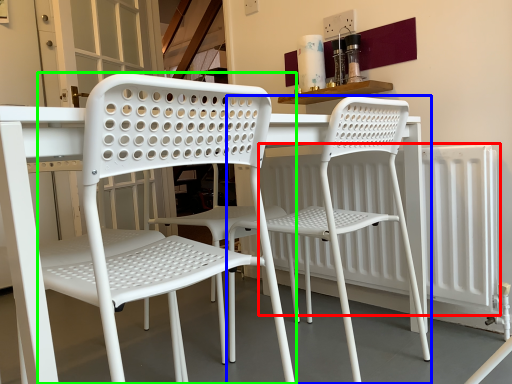
Question: Which object is positioned farthest from radiator (highlighted by a red box)? Select from chair (highlighted by a blue box) and chair (highlighted by a green box).

Choices:
 (A) chair
 (B) chair

Answer: (B)